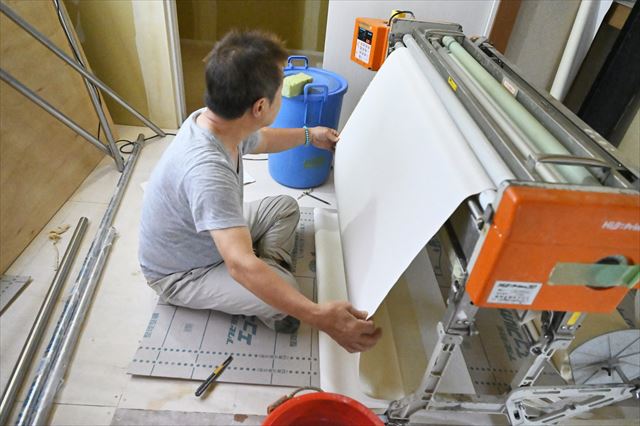
Where is `doorway`? Image resolution: width=640 pixels, height=426 pixels. doorway is located at coordinates (161, 33), (337, 25).